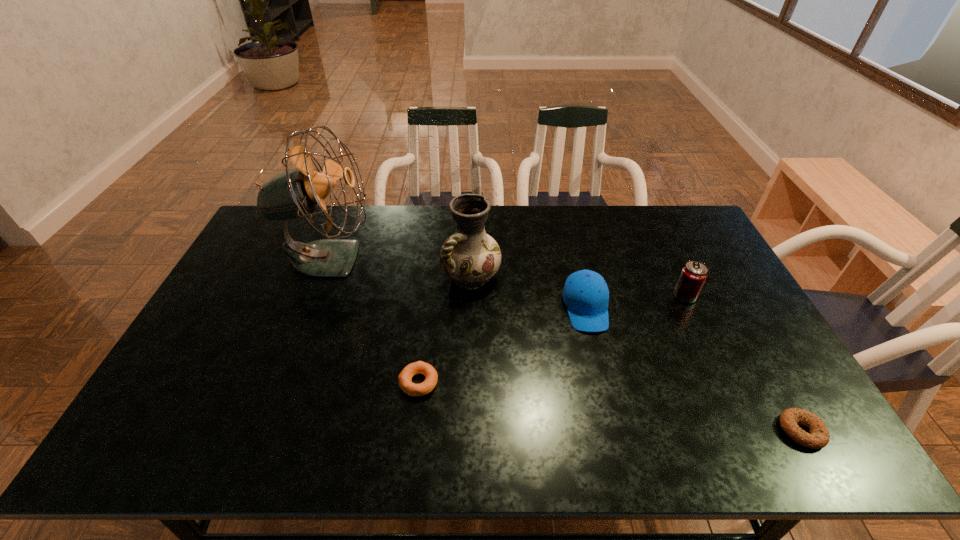
Locate an element on the screen. The width and height of the screenshot is (960, 540). the tallest object is located at coordinates (295, 193).

Locate an element on the screen. Image resolution: width=960 pixels, height=540 pixels. the leftmost object is located at coordinates point(295,193).

Image resolution: width=960 pixels, height=540 pixels. What are the coordinates of `vase` in the screenshot? It's located at (470, 257).

Identify the location of pop soda. (694, 273).

This screenshot has height=540, width=960. I want to click on the fourth shortest object, so pyautogui.click(x=694, y=273).

Locate an element on the screen. cap is located at coordinates (586, 295).

You are a GUI agent. You are given a task and a screenshot of the screen. Output one action in this format:
    pyautogui.click(x=<x>, y=<y>)
    Task: Click on the fourth tallest object
    
    Given the screenshot: What is the action you would take?
    pyautogui.click(x=586, y=295)

Identify the location of the farther bagel. (419, 367).

The height and width of the screenshot is (540, 960). I want to click on the second nearest object, so click(419, 367).

This screenshot has height=540, width=960. In order to click on the nearest object in this screenshot , I will do `click(818, 438)`.